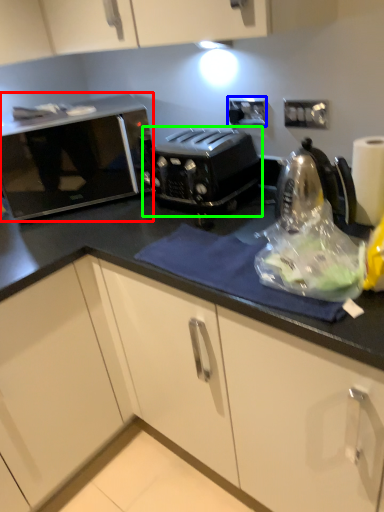
Question: Which object is the farthest from home appliance (highlighted by a red box)? Choose among these: electric outlet (highlighted by a blue box) or toaster (highlighted by a green box).

Choices:
 (A) electric outlet
 (B) toaster

Answer: (A)